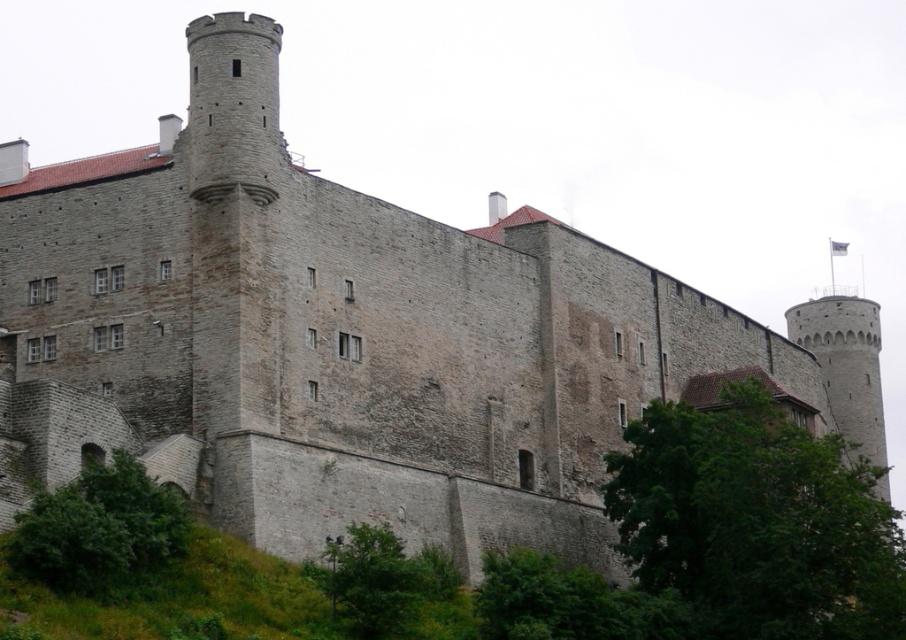
Is green leafy tree at lower right wider than green leafy tree at lower center?

Yes, green leafy tree at lower right is wider than green leafy tree at lower center.

Between green leafy tree at lower right and green leafy tree at lower center, which one is positioned higher?

green leafy tree at lower right is higher up.

Who is more forward, (695, 552) or (378, 630)?

Point (378, 630) is more forward.

You are a GUI agent. You are given a task and a screenshot of the screen. Output one action in this format:
    pyautogui.click(x=<x>, y=<y>)
    Task: Click on the green leafy tree at lower right
    The image size is (906, 640).
    Given the screenshot: What is the action you would take?
    pyautogui.click(x=757, y=522)

Who is more forward, (757, 387) or (41, 540)?

Point (41, 540)

Is point (683, 502) farther from camera compared to point (145, 492)?

Yes, it is behind point (145, 492).

Is point (872, 634) positioned after point (103, 497)?

Yes, it is.

Locate an element on the screen. green leafy tree at lower right is located at coordinates (757, 522).

Is green leafy bush at lower left above green leafy tree at lower center?

Yes, green leafy bush at lower left is above green leafy tree at lower center.

Does point (178, 536) come closer to viewer compared to point (348, 602)?

No, (178, 536) is further to viewer.

Measure the distance between green leafy bush at lower left and camera.

A distance of 49.12 meters exists between green leafy bush at lower left and camera.

At what (x,y) coordinates should I click in order to perform the action: click on green leafy bush at lower left. Please return your answer as a coordinate pair (x, y). Image resolution: width=906 pixels, height=640 pixels. Looking at the image, I should click on (100, 529).